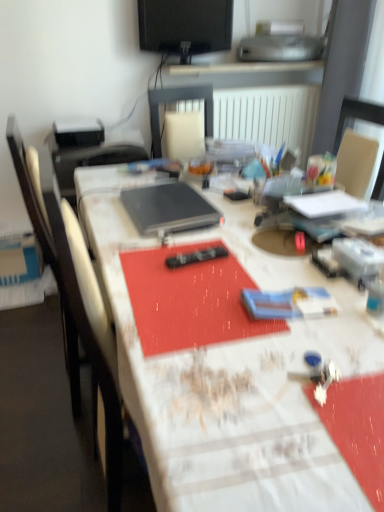
Question: Does white textured table at center have a lesser height compared to black glossy monitor at upper center?

Choices:
 (A) no
 (B) yes

Answer: (A)

Question: Is white textured table at center further to the viewer compared to black glossy monitor at upper center?

Choices:
 (A) no
 (B) yes

Answer: (A)

Question: Is white textured table at center to the right of black glossy monitor at upper center from the viewer's perspective?

Choices:
 (A) yes
 (B) no

Answer: (A)

Question: From the image's perspective, would you say white textured table at center is positioned over black glossy monitor at upper center?

Choices:
 (A) yes
 (B) no

Answer: (B)

Question: Can you confirm if white textured table at center is wider than black glossy monitor at upper center?

Choices:
 (A) yes
 (B) no

Answer: (A)

Question: Considering the relative positions of black plastic remote control at center and white textured table at center in the image provided, is black plastic remote control at center to the left or to the right of white textured table at center?

Choices:
 (A) right
 (B) left

Answer: (B)

Question: From a real-world perspective, is black plastic remote control at center physically located above or below white textured table at center?

Choices:
 (A) above
 (B) below

Answer: (A)

Question: Relative to white textured table at center, is black plastic remote control at center in front or behind?

Choices:
 (A) behind
 (B) front

Answer: (A)

Question: Considering the positions of black plastic remote control at center and white textured table at center in the image, is black plastic remote control at center taller or shorter than white textured table at center?

Choices:
 (A) short
 (B) tall

Answer: (A)

Question: Do you think silver metallic printer at upper center is within black glossy monitor at upper center, or outside of it?

Choices:
 (A) inside
 (B) outside

Answer: (B)

Question: Looking at the image, does silver metallic printer at upper center seem bigger or smaller compared to black glossy monitor at upper center?

Choices:
 (A) small
 (B) big

Answer: (B)

Question: Is silver metallic printer at upper center in front of or behind black glossy monitor at upper center in the image?

Choices:
 (A) front
 (B) behind

Answer: (B)

Question: In terms of width, does silver metallic printer at upper center look wider or thinner when compared to black glossy monitor at upper center?

Choices:
 (A) thin
 (B) wide

Answer: (B)

Question: From their relative heights in the image, would you say black plastic remote control at center is taller or shorter than black glossy monitor at upper center?

Choices:
 (A) tall
 (B) short

Answer: (B)

Question: From the image's perspective, is black plastic remote control at center positioned above or below black glossy monitor at upper center?

Choices:
 (A) below
 (B) above

Answer: (A)